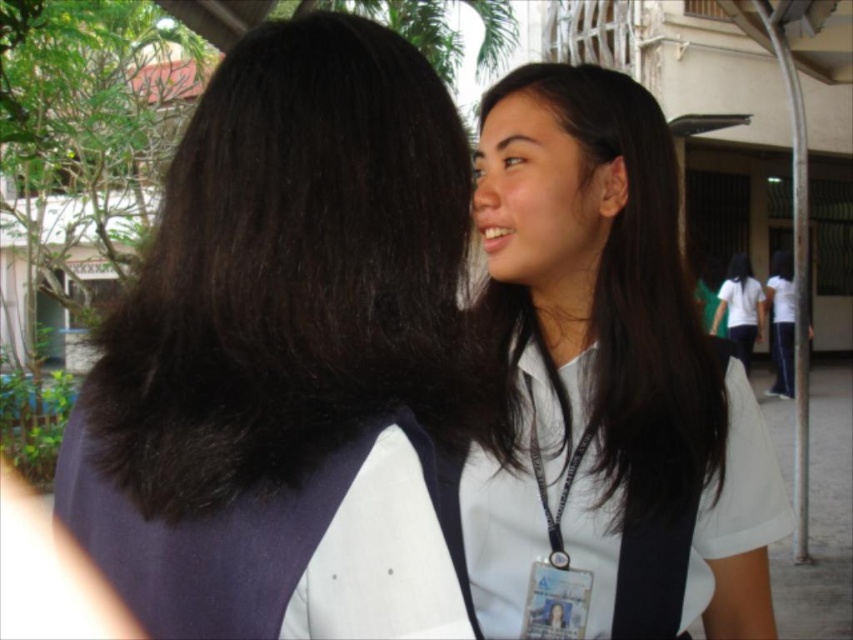
Question: Does white matte uniform at center have a lesser width compared to white matte shirt at right?

Choices:
 (A) yes
 (B) no

Answer: (A)

Question: Which point is closer to the camera?

Choices:
 (A) white matte shirt at right
 (B) dark brown silky hair at upper right
 (C) white matte uniform at center

Answer: (B)

Question: Does dark brown silky hair at upper right appear under white matte uniform at center?

Choices:
 (A) no
 (B) yes

Answer: (A)

Question: Among these objects, which one is nearest to the camera?

Choices:
 (A) white matte uniform at center
 (B) white matte shirt at right

Answer: (A)

Question: Is white matte uniform at center thinner than white matte shirt at right?

Choices:
 (A) yes
 (B) no

Answer: (A)

Question: Based on their relative distances, which object is nearer to the white matte shirt at right?

Choices:
 (A) white matte uniform at center
 (B) dark brown silky hair at upper right

Answer: (A)